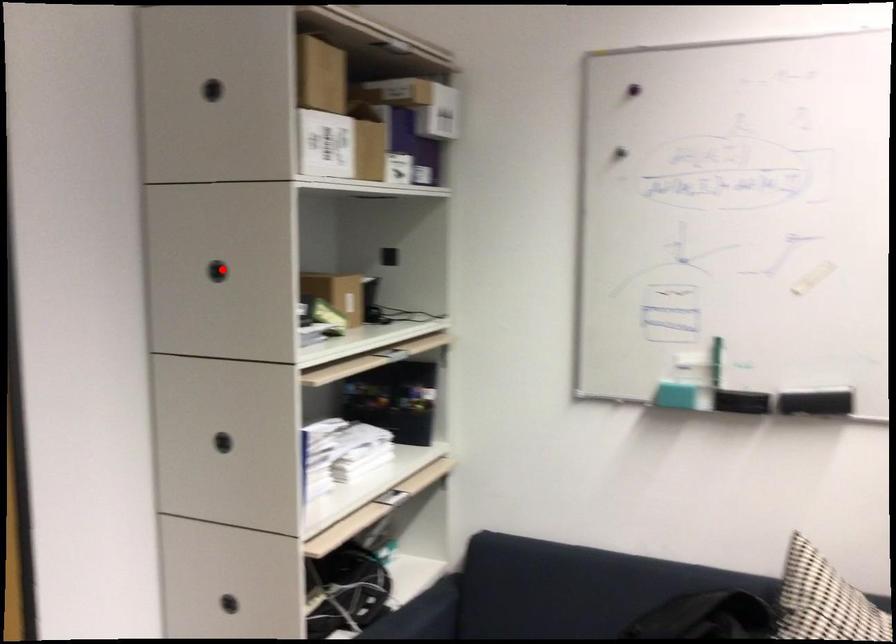
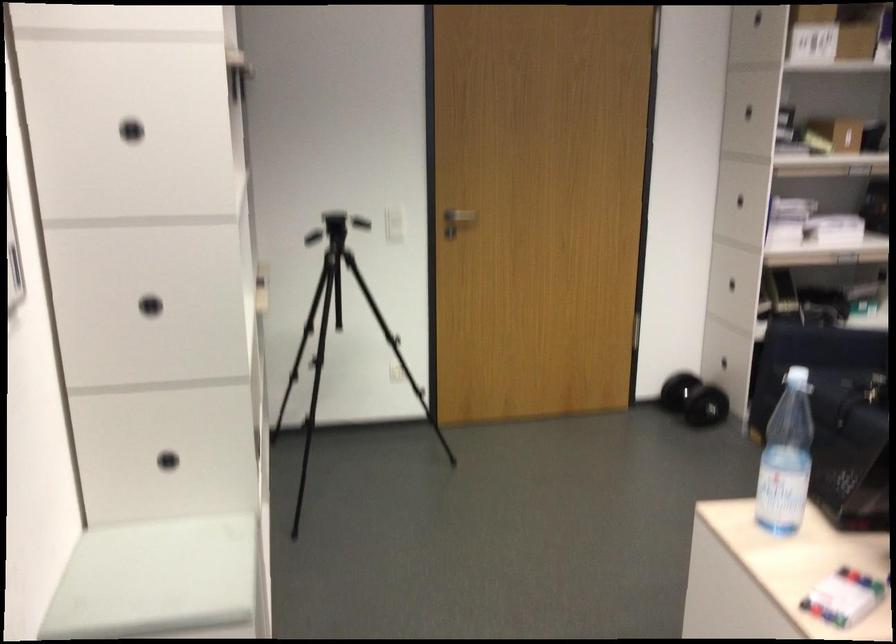
Where in the second image is the point corresponding to the highlighted location from the first image?

(747, 111)